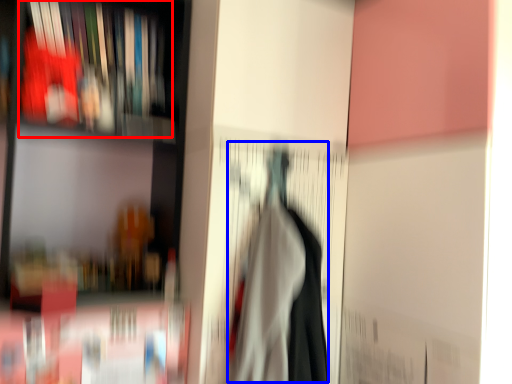
Question: Which object is closer to the camera taking this photo, book (highlighted by a red box) or woman (highlighted by a blue box)?

Choices:
 (A) book
 (B) woman

Answer: (B)